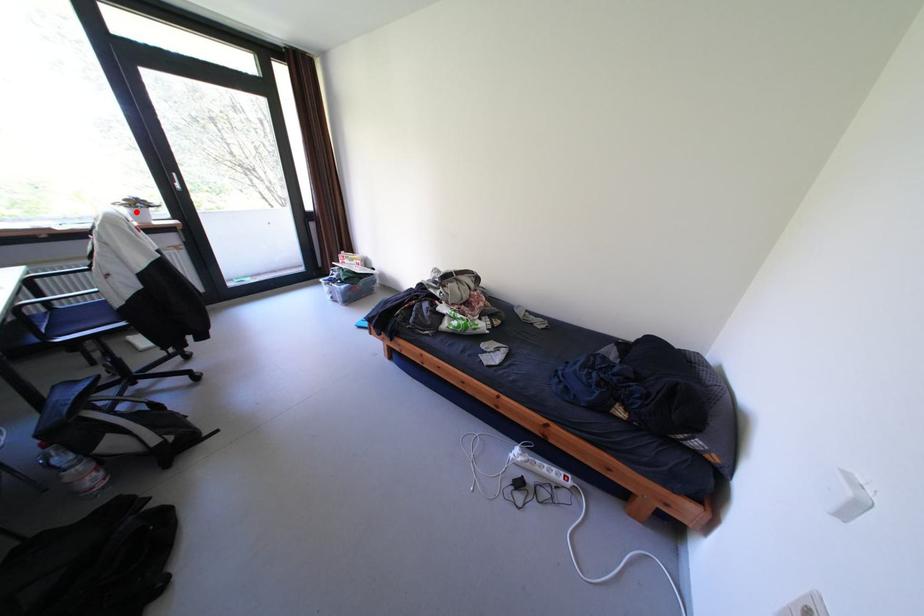
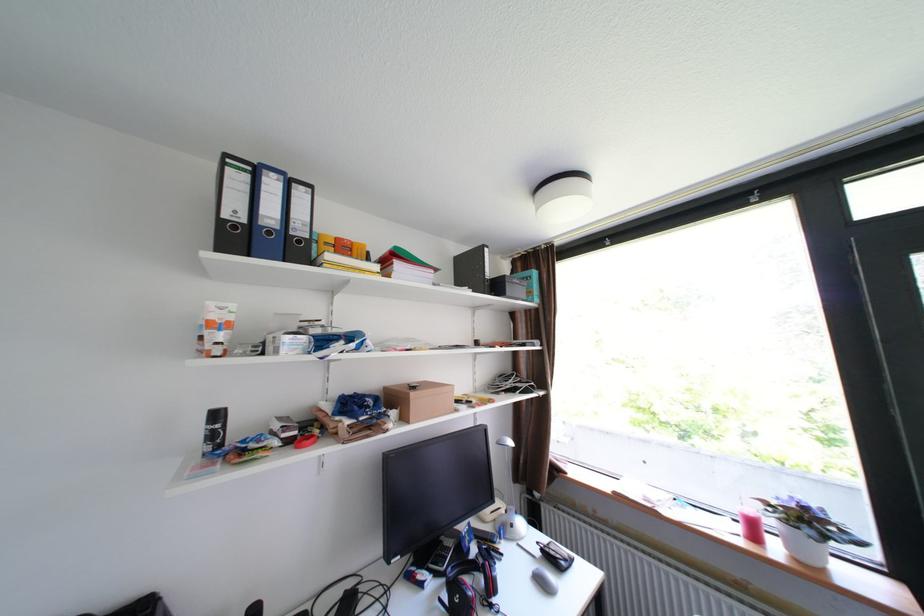
Question: I am providing you with two images of the same scene from different viewpoints. Image1 has a red point marked. In image2, the corresponding 3D location appears at what relative position? Reply with the corresponding letter.

Choices:
 (A) Closer
 (B) Farther

Answer: (A)